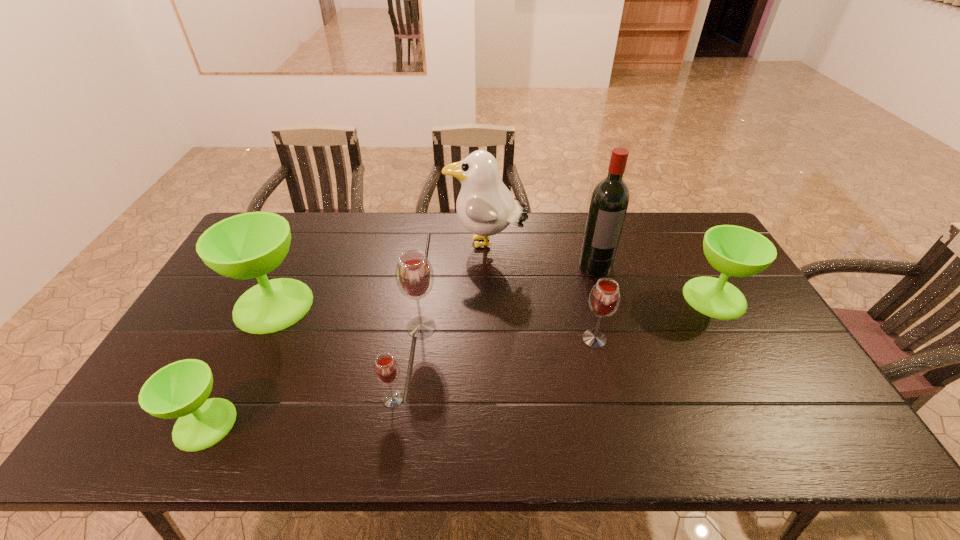
Where is `the fourth closest object to the biggest red wineglass`? This screenshot has width=960, height=540. the fourth closest object to the biggest red wineglass is located at coordinates (604, 299).

You are a GUI agent. You are given a task and a screenshot of the screen. Output one action in this format:
    pyautogui.click(x=<x>, y=<y>)
    Task: Click on the sixth closest object to the smallest red wineglass
    Image resolution: width=960 pixels, height=540 pixels.
    Given the screenshot: What is the action you would take?
    pyautogui.click(x=609, y=202)

Locate which wineglass ranks second in proximity to the smallest green wineglass. Please provide its 2D coordinates. Your answer should be formatted as a tuple, i.e. [(x, y)], where the tuple contains the x and y coordinates of a point satisfying the conditions above.

[(386, 369)]

Where is `wineglass that stands as the third closest to the smallest red wineglass`? This screenshot has width=960, height=540. wineglass that stands as the third closest to the smallest red wineglass is located at coordinates (180, 390).

The image size is (960, 540). I want to click on the second closest red wineglass relative to the smallest red wineglass, so click(x=604, y=299).

Choose which red wineglass is the third nearest neighbor to the red wine bottle. Please provide its 2D coordinates. Your answer should be formatted as a tuple, i.e. [(x, y)], where the tuple contains the x and y coordinates of a point satisfying the conditions above.

[(386, 369)]

You are a GUI agent. You are given a task and a screenshot of the screen. Output one action in this format:
    pyautogui.click(x=<x>, y=<y>)
    Task: Click on the second closest green wineglass to the wine bottle
    
    Given the screenshot: What is the action you would take?
    pyautogui.click(x=250, y=245)

Select which green wineglass appears as the second closest to the fourth object from right to left. Please provide its 2D coordinates. Your answer should be formatted as a tuple, i.e. [(x, y)], where the tuple contains the x and y coordinates of a point satisfying the conditions above.

[(736, 251)]

Where is `free spot that satisfies the following two spatial constraints: 1. on the back side of the smallest red wineglass; 2. on the left side of the second smallest green wineglass`? This screenshot has height=540, width=960. free spot that satisfies the following two spatial constraints: 1. on the back side of the smallest red wineglass; 2. on the left side of the second smallest green wineglass is located at coordinates (410, 298).

Identify the location of free region that satisfies the following two spatial constraints: 1. on the beak of the gull; 2. on the left side of the fifth wineglass from left to right. click(488, 339).